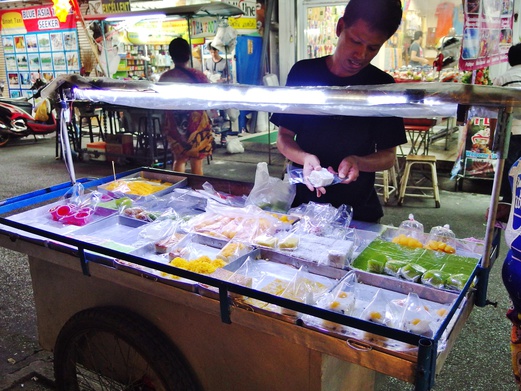
Find the location of `stools`. stools is located at coordinates (417, 161), (388, 173).